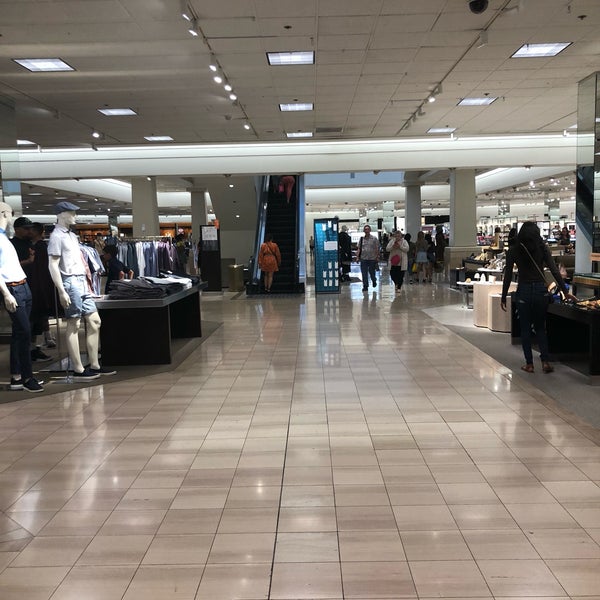
Find the location of `tile flooring`. tile flooring is located at coordinates pos(329,468).